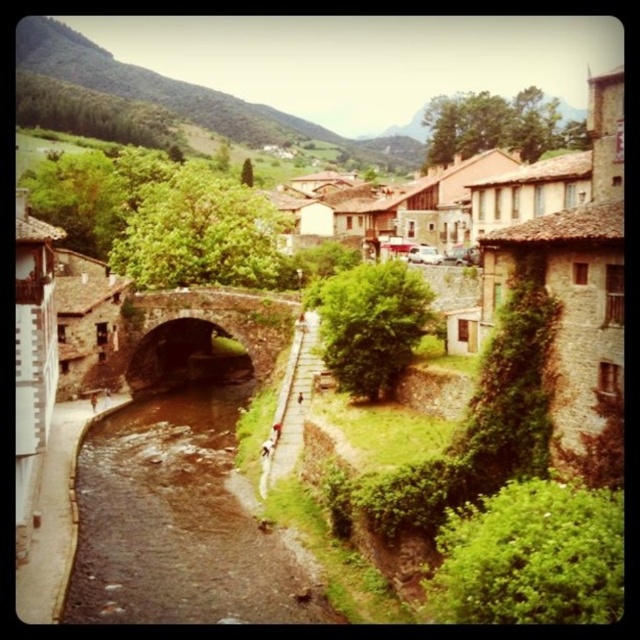
You are standing at the edge of the village looking towards the river and bridge. Which object, the brown smooth river at center or the dark brown stone bridge at center, is closer to you?

The brown smooth river at center is closer to the viewer than the dark brown stone bridge at center.

You are standing at the entrance of the village and want to cross the river. The map shows the brown smooth river at center is located at coordinates 0.817, 0.277. If you are at position 0.0, 0.0, which direction should you head to reach the bridge over the river?

The brown smooth river at center is located at coordinates (x=177, y=522). Since you are at position (x=0, y=0), you should head towards the right and forward direction to reach the bridge over the river.

You are standing on the dark brown stone bridge at center and want to cross to the other side. Which direction should you walk to reach the brown smooth river at center?

To reach the brown smooth river at center from the dark brown stone bridge at center, you should walk to the right since the brown smooth river at center is located to the right of the bridge.